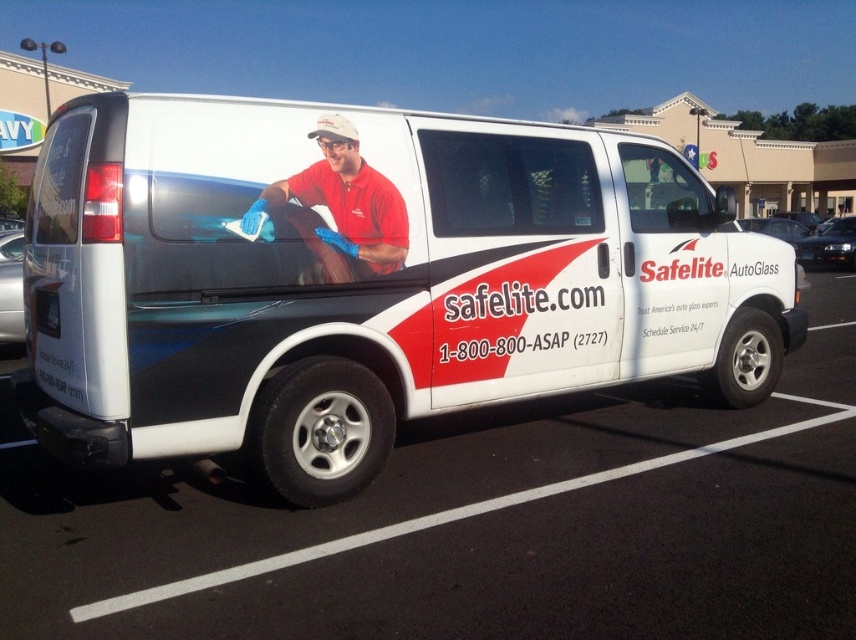
Is white matte van at center closer to camera compared to white glossy van at center?

No, it is behind white glossy van at center.

Can you confirm if white matte van at center is taller than white glossy van at center?

Indeed, white matte van at center has a greater height compared to white glossy van at center.

Which is behind, point (189, 156) or point (70, 628)?

Point (189, 156)

At what (x,y) coordinates should I click in order to perform the action: click on white matte van at center. Please return your answer as a coordinate pair (x, y). Looking at the image, I should click on (366, 280).

Between white matte van at center and matte red shirt at center, which one has less height?

white matte van at center is shorter.

Between white matte van at center and matte red shirt at center, which one appears on the right side from the viewer's perspective?

white matte van at center

Locate an element on the screen. Image resolution: width=856 pixels, height=640 pixels. white matte van at center is located at coordinates (366, 280).

Is white glossy van at center shorter than matte red shirt at center?

Indeed, white glossy van at center has a lesser height compared to matte red shirt at center.

Does white glossy van at center appear under matte red shirt at center?

Indeed, white glossy van at center is positioned under matte red shirt at center.

Does point (805, 472) come closer to viewer compared to point (342, 188)?

That is False.

Locate an element on the screen. Image resolution: width=856 pixels, height=640 pixels. white glossy van at center is located at coordinates 477,525.